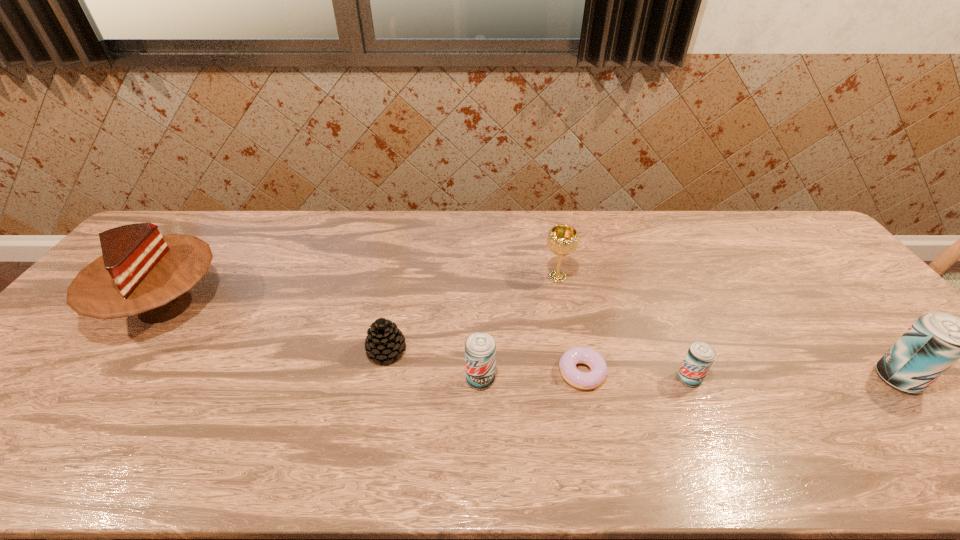
Where is `vacant position in the image that satisfies the following two spatial constraints: 1. on the front side of the chalice; 2. on the left side of the second object from right to left`? The image size is (960, 540). vacant position in the image that satisfies the following two spatial constraints: 1. on the front side of the chalice; 2. on the left side of the second object from right to left is located at coordinates (577, 379).

Identify the location of free region that satisfies the following two spatial constraints: 1. on the back side of the rightmost beer can; 2. on the left side of the leftmost beer can. (480, 379).